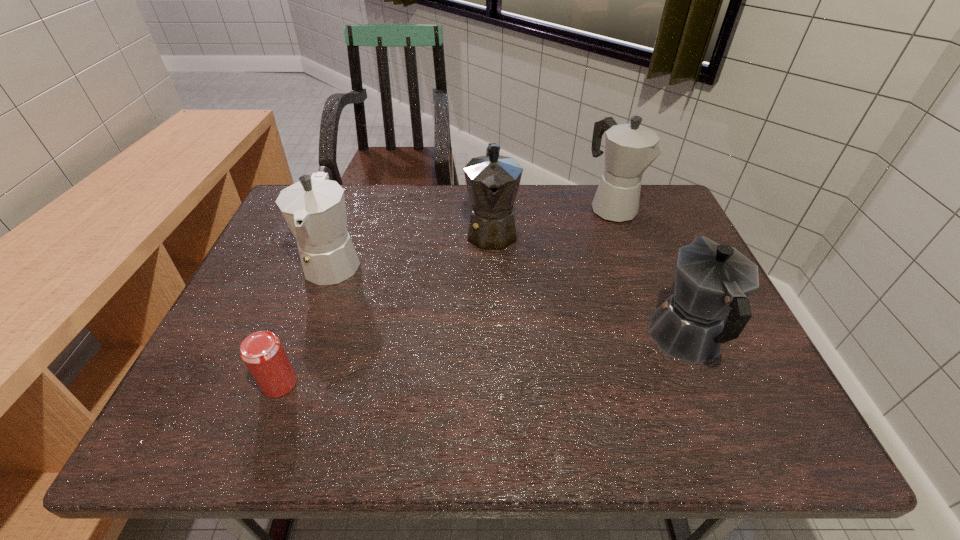
At what (x,y) coordinates should I click in order to perform the action: click on empty location between the leftmost coffeepot and the third object from right to left. Please return your answer as a coordinate pair (x, y). Image resolution: width=960 pixels, height=540 pixels. Looking at the image, I should click on (413, 245).

The width and height of the screenshot is (960, 540). I want to click on empty space that is in between the beer can and the leftmost coffeepot, so click(306, 322).

What are the coordinates of `empty space that is in between the leftmost coffeepot and the nearest coffeepot` in the screenshot? It's located at (510, 299).

Identify the location of unoccupied area between the shortest object and the leftmost coffeepot. The image size is (960, 540). (306, 322).

Image resolution: width=960 pixels, height=540 pixels. I want to click on empty space that is in between the third object from right to left and the beer can, so click(386, 307).

Where is `free space between the nearest coffeepot and the leftmost coffeepot`? The width and height of the screenshot is (960, 540). free space between the nearest coffeepot and the leftmost coffeepot is located at coordinates (510, 299).

Image resolution: width=960 pixels, height=540 pixels. Identify the location of free spot between the leftmost coffeepot and the beer can. (306, 322).

The width and height of the screenshot is (960, 540). What are the coordinates of `object that is the second closest to the leftmost coffeepot` in the screenshot? It's located at click(492, 181).

Locate an element on the screen. This screenshot has width=960, height=540. object that is the closest to the leftmost coffeepot is located at coordinates (262, 352).

I want to click on coffeepot that is the closest to the shortest object, so click(314, 208).